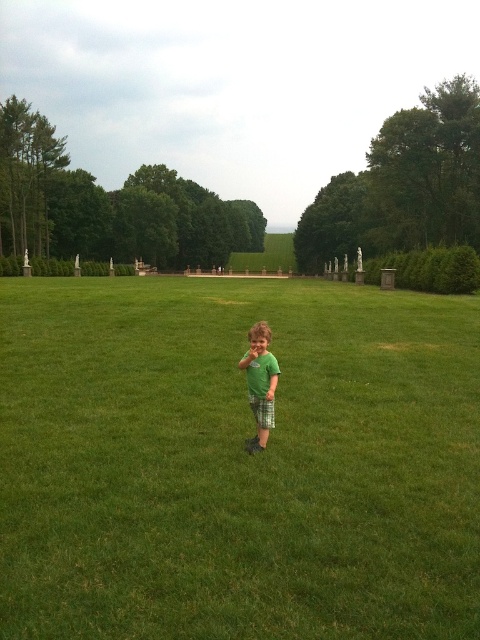
Can you confirm if green grass at center is positioned to the right of green matte shirt at center?

Indeed, green grass at center is positioned on the right side of green matte shirt at center.

Which of these two, green grass at center or green matte shirt at center, stands shorter?

green matte shirt at center

Is point (311, 358) closer to viewer compared to point (263, 429)?

No, (311, 358) is further to viewer.

In order to click on green grass at center in this screenshot , I will do `click(237, 461)`.